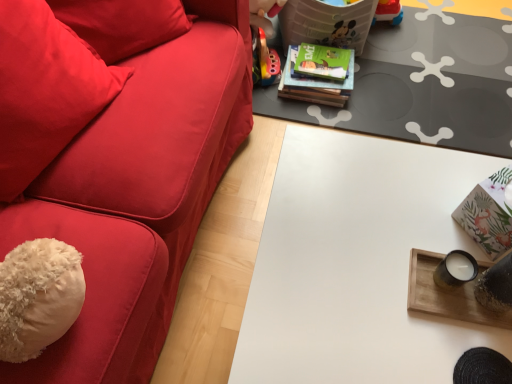
At what (x,y) coordinates should I click in order to perform the action: click on vacant space to the left of wooden tray at right, positioned as the 2th table in back-to-front order. Please return your answer as a coordinate pair (x, y). The height and width of the screenshot is (384, 512). Looking at the image, I should click on (394, 285).